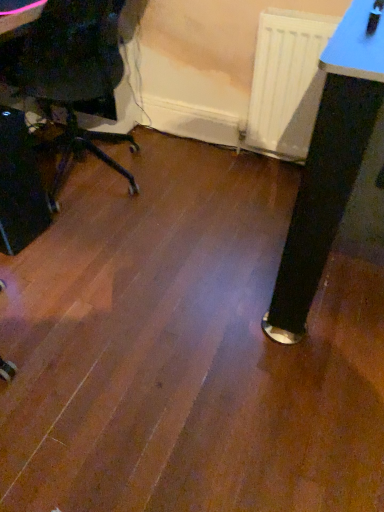
Find the location of `free space on the front side of black plastic computer tower at left`. free space on the front side of black plastic computer tower at left is located at coordinates (23, 281).